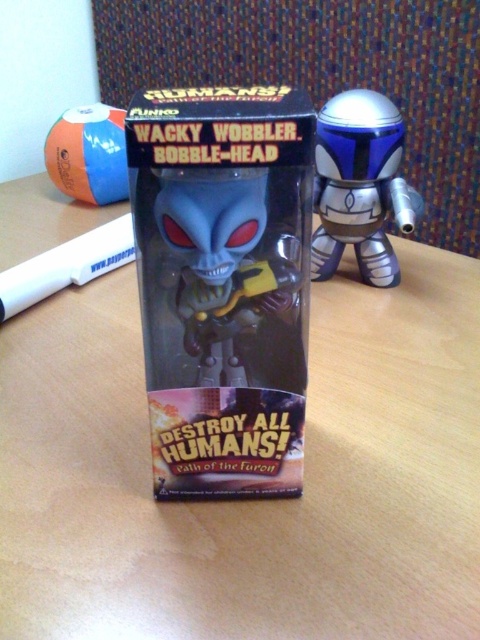
Question: Where is metallic blue helmet at upper right located in relation to white plastic pen at lower left in the image?

Choices:
 (A) left
 (B) right

Answer: (B)

Question: Does wooden table at center have a greater width compared to white plastic pen at lower left?

Choices:
 (A) yes
 (B) no

Answer: (A)

Question: Which point is closer to the camera?

Choices:
 (A) (109, 224)
 (B) (60, 400)
 (C) (192, 257)
 (D) (345, 138)

Answer: (C)

Question: Among these objects, which one is nearest to the camera?

Choices:
 (A) matte plastic box at center
 (B) wooden table at center

Answer: (A)

Question: Can you confirm if metallic blue helmet at upper right is smaller than white plastic pen at lower left?

Choices:
 (A) no
 (B) yes

Answer: (B)

Question: Which of the following is the closest to the observer?

Choices:
 (A) white plastic pen at lower left
 (B) orange rubber ball at upper left
 (C) metallic blue helmet at upper right

Answer: (C)